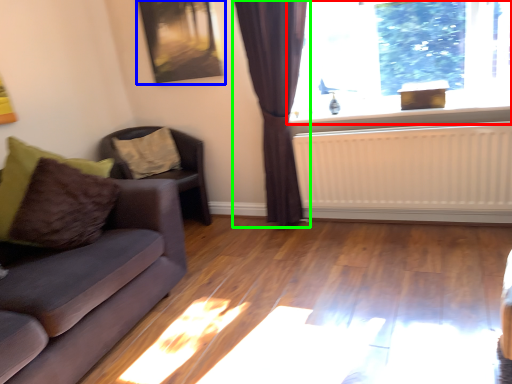
Question: Based on their relative distances, which object is nearer to window (highlighted by a red box)? Choose from picture frame (highlighted by a blue box) and curtain (highlighted by a green box).

Choices:
 (A) picture frame
 (B) curtain

Answer: (B)